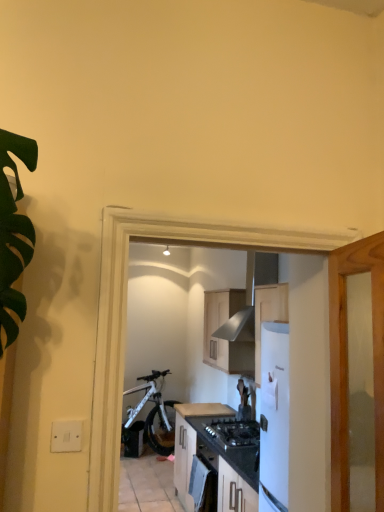
Question: Considering the positions of point (127, 425) and point (180, 408), is point (127, 425) closer or farther from the camera than point (180, 408)?

Choices:
 (A) farther
 (B) closer

Answer: (A)

Question: Considering the positions of white matte bicycle at center and matte brown countertop at center in the image, is white matte bicycle at center bigger or smaller than matte brown countertop at center?

Choices:
 (A) small
 (B) big

Answer: (B)

Question: Considering the real-world distances, which object is farthest from the satin black oven at center?

Choices:
 (A) white matte bicycle at center
 (B) white matte cabinet at center, the first cabinetry in the bottom-to-top sequence
 (C) matte brown countertop at center
 (D) wooden cabinet at center, arranged as the 2th cabinetry when ordered from the bottom
 (E) black matte gas stove at center

Answer: (A)

Question: Based on their relative distances, which object is farther from the matte brown countertop at center?

Choices:
 (A) white matte cabinet at center, the first cabinetry in the bottom-to-top sequence
 (B) white matte bicycle at center
 (C) wooden cabinet at center, marked as the first cabinetry in a top-to-bottom arrangement
 (D) black matte gas stove at center
 (E) satin black oven at center

Answer: (B)